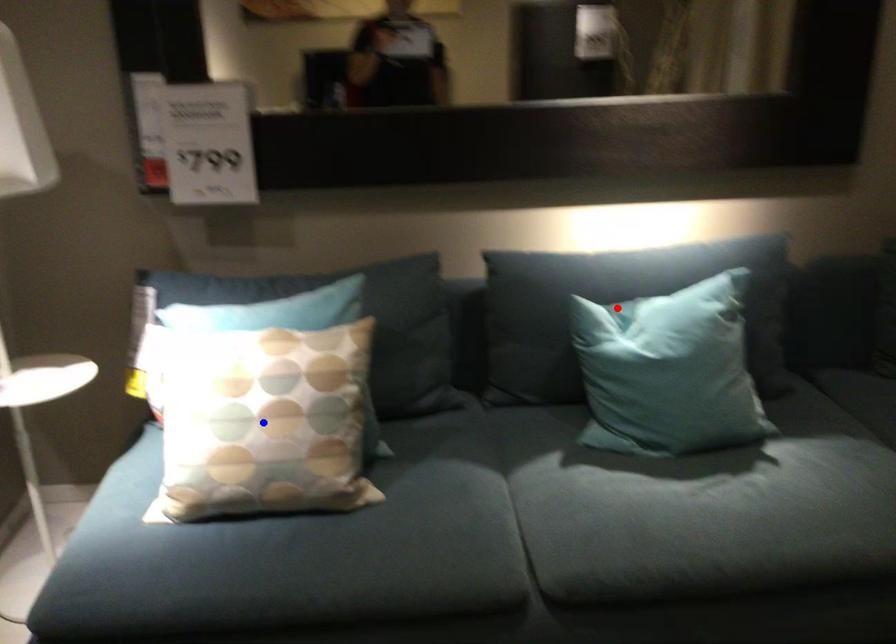
Question: In the image, two points are highlighted. Which point is nearer to the camera? Reply with the corresponding letter.

Choices:
 (A) blue point
 (B) red point

Answer: (A)